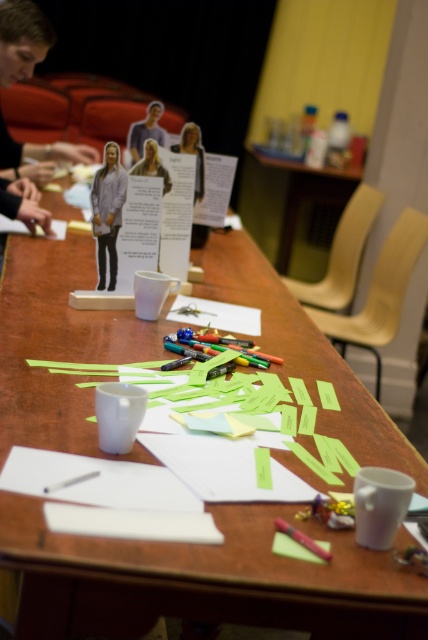
Question: Can you confirm if matte gray figure at upper left is thinner than cardboard figure at center?

Choices:
 (A) yes
 (B) no

Answer: (B)

Question: Is matte white shirt at center below cardboard figure at center?

Choices:
 (A) yes
 (B) no

Answer: (A)

Question: Which point appears closest to the camera in this image?

Choices:
 (A) (101, 275)
 (B) (146, 172)
 (C) (137, 140)

Answer: (A)

Question: Which point appears closest to the camera in this image?

Choices:
 (A) (145, 138)
 (B) (163, 168)
 (C) (145, 150)

Answer: (C)

Question: Can you confirm if matte cardboard figure at center is thinner than pink matte pen at lower center?

Choices:
 (A) no
 (B) yes

Answer: (A)

Question: Which of the following is the farthest from the observer?

Choices:
 (A) (155, 172)
 (B) (299, 538)

Answer: (A)